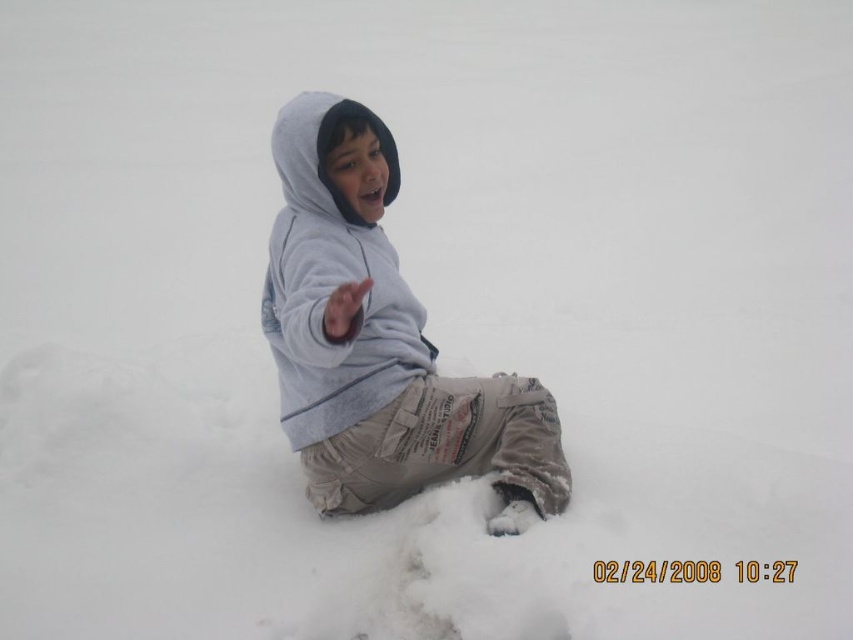
You are a fashion designer observing the child in the snowy scene. You need to determine which clothing item is taller between the matte gray hoodie at center and the gray fleece sweatshirt at center. Which one is taller?

The matte gray hoodie at center is taller than the gray fleece sweatshirt at center according to the description.

You are a photographer trying to capture the child in the image. You want to focus on the point closer to the camera between point [515,520] and point [352,276]. Which point should you choose?

Point [352,276] is closer to the camera than point [515,520], so you should focus on point [352,276] to capture the child in focus.

You are a clothing designer trying to create a new winter outfit. You have both the matte gray hoodie at center and the gray fleece sweatshirt at center. Which one should you choose if you want the garment to have a wider silhouette?

The matte gray hoodie at center has a larger width than the gray fleece sweatshirt at center, so it would be the better choice for a wider silhouette.